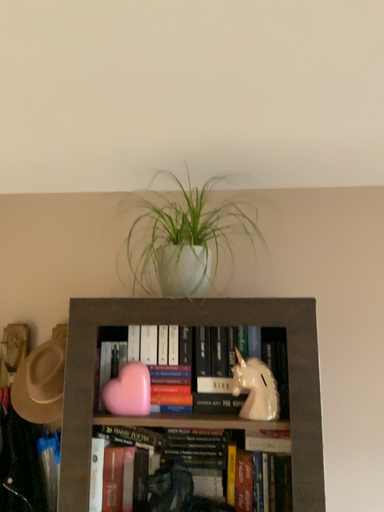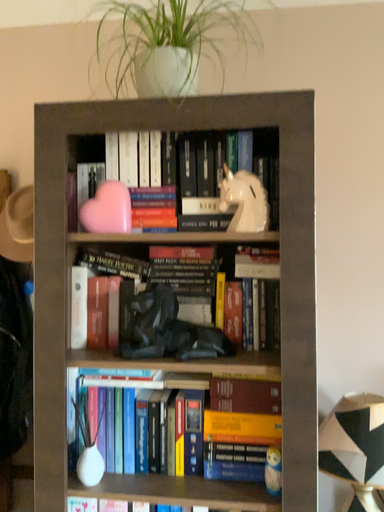
Question: Which way did the camera rotate in the video?

Choices:
 (A) rotated downward
 (B) rotated upward

Answer: (A)